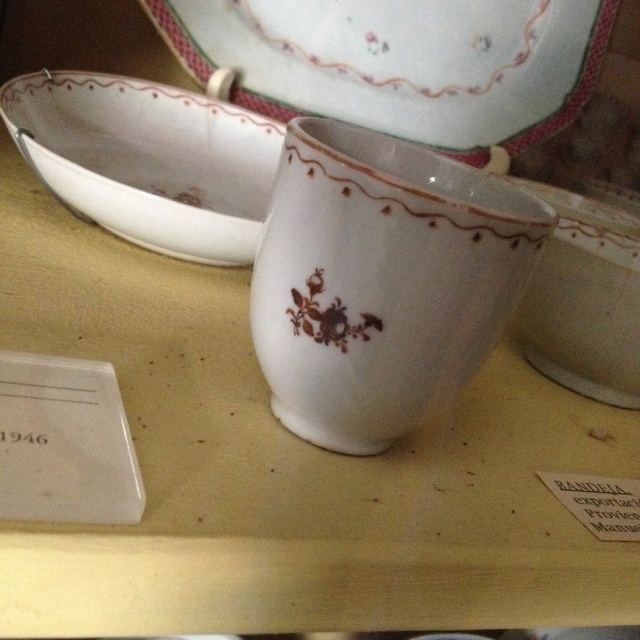
You are an art curator examining the ceramic display. You notice two points marked on the image at coordinates point (307, 33) and point (600, 362). Based on the spatial arrangement of the ceramics, which point is closer to the viewer?

Point (600, 362) is closer to the viewer because the description states that point (307, 33) is behind point (600, 362).

You are an art curator examining the ceramic bowls displayed in the museum. You need to determine which bowl is shorter in height between the white porcelain bowl at upper left and the white porcelain bowl at center. Which one is shorter?

The white porcelain bowl at upper left is shorter in height compared to the white porcelain bowl at center.